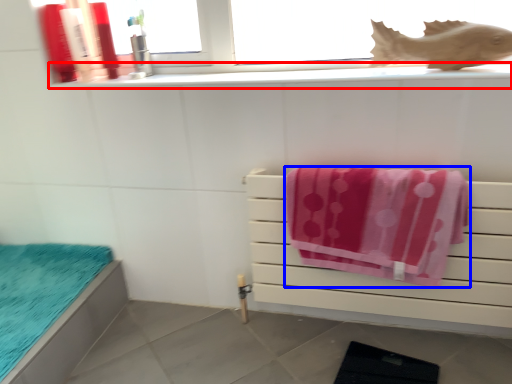
Question: Which of the following is the farthest to the observer, window sill (highlighted by a red box) or towel (highlighted by a blue box)?

Choices:
 (A) window sill
 (B) towel

Answer: (A)